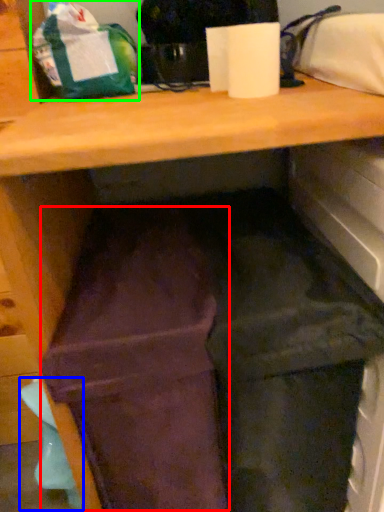
Question: Which is farther away from wide (highlighted by a red box)? waste (highlighted by a blue box) or bag (highlighted by a green box)?

Choices:
 (A) waste
 (B) bag

Answer: (B)